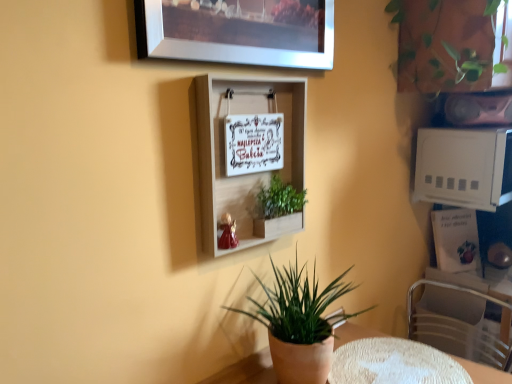
Find the location of a particular element. The height and width of the screenshot is (384, 512). empty space that is ontop of white textured table at lower center (from a real-world perspective) is located at coordinates (393, 363).